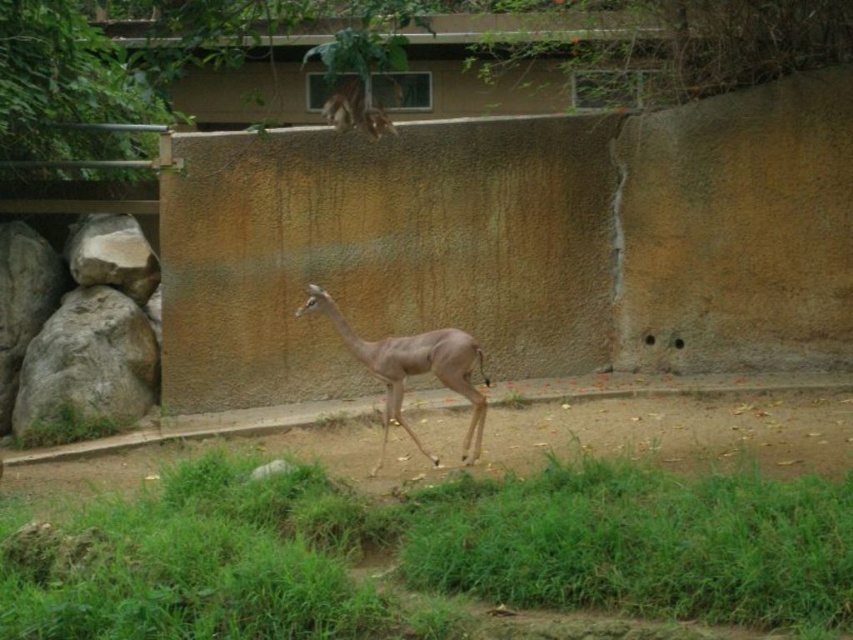
You are a zookeeper observing the gerenuk in its enclosure. You notice the green grass at lower center and the light brown fur at center. Which object is closer to the ground?

The green grass at lower center is closer to the ground as it is positioned below the light brown fur at center.

You are a zookeeper who needs to ensure the gerenuk has enough space to move freely. Based on the image, which area is wider between the green grass at lower center and the light brown fur at center?

The green grass at lower center is wider than the light brown fur at center, so the gerenuk has more space in the green grass area.